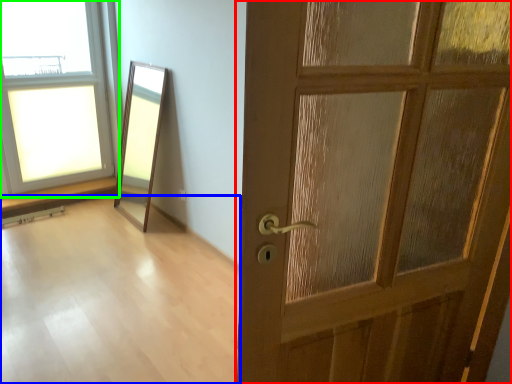
Question: Based on their relative distances, which object is nearer to door (highlighted by a red box)? Choose from corridor (highlighted by a blue box) and window (highlighted by a green box).

Choices:
 (A) corridor
 (B) window

Answer: (A)